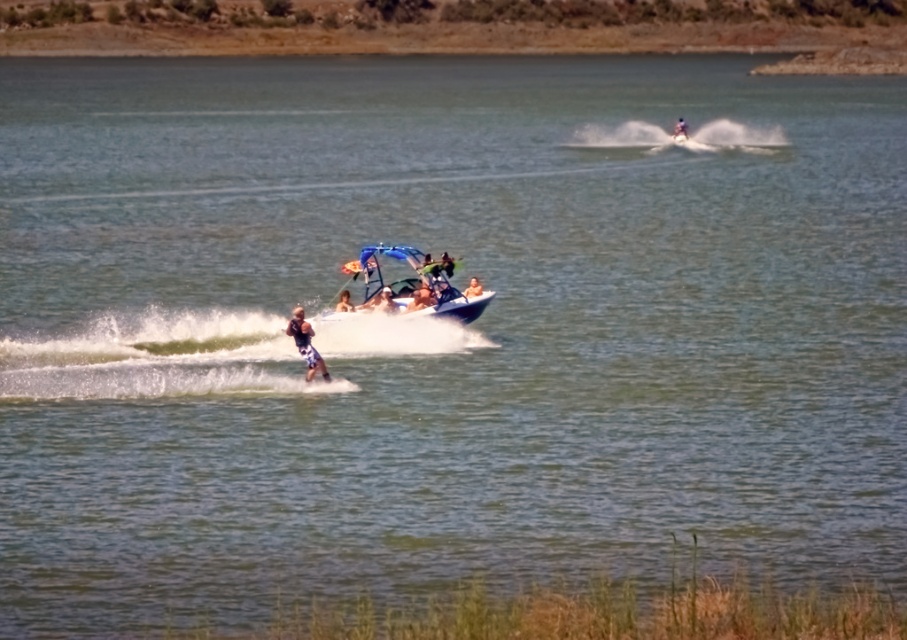
Question: Does blue striped shorts at center have a greater width compared to smooth blue board at center?

Choices:
 (A) yes
 (B) no

Answer: (A)

Question: Is blue glossy boat at center to the left of blue striped shorts at center from the viewer's perspective?

Choices:
 (A) yes
 (B) no

Answer: (B)

Question: Is smooth tan skin at center positioned in front of smooth white surfboard at upper center?

Choices:
 (A) no
 (B) yes

Answer: (B)

Question: Which object appears closest to the camera in this image?

Choices:
 (A) smooth white surfboard at upper center
 (B) smooth blue board at center
 (C) blue striped shorts at center
 (D) matte blue shorts at center

Answer: (C)

Question: Considering the real-world distances, which object is closest to the smooth tan skin at center?

Choices:
 (A) matte blue shorts at center
 (B) smooth blue board at center

Answer: (B)

Question: Which object appears farthest from the camera in this image?

Choices:
 (A) blue striped shorts at center
 (B) matte blue shorts at center
 (C) smooth tan skin at center
 (D) blue glossy boat at center

Answer: (C)